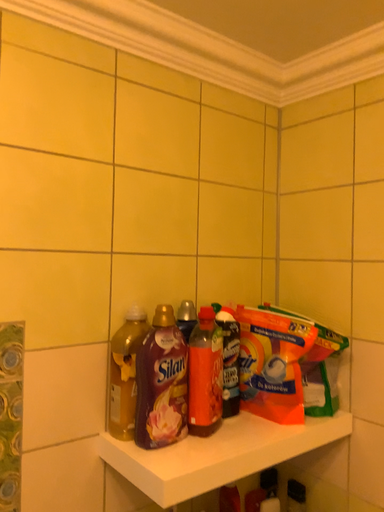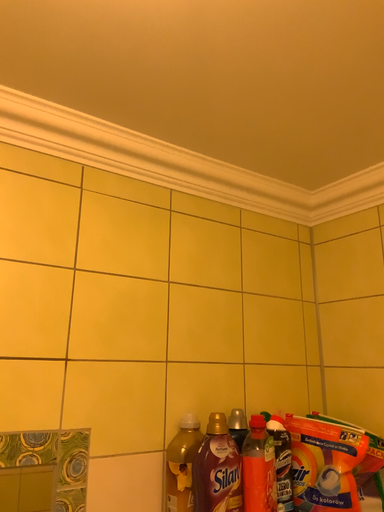
Question: How did the camera likely rotate when shooting the video?

Choices:
 (A) rotated upward
 (B) rotated downward

Answer: (A)